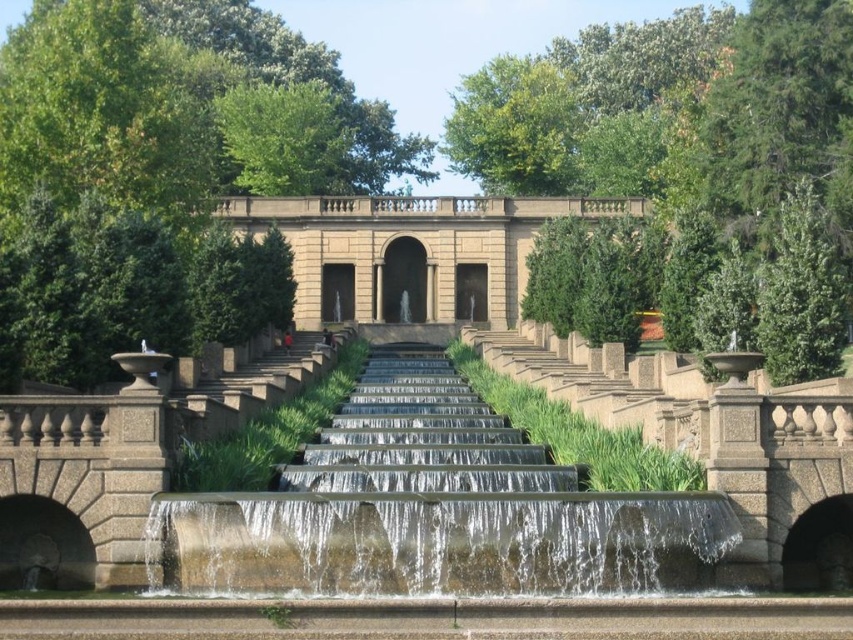
Question: Observing the image, what is the correct spatial positioning of beige stone palace at center in reference to smooth stone stairs at center?

Choices:
 (A) right
 (B) left

Answer: (A)

Question: Estimate the real-world distances between objects in this image. Which object is farther from the smooth stone stairs at center?

Choices:
 (A) beige stone palace at center
 (B) smooth concrete fountain at center

Answer: (A)

Question: Which object is closer to the camera taking this photo?

Choices:
 (A) smooth stone stairs at center
 (B) smooth concrete fountain at center

Answer: (B)

Question: Does beige stone palace at center have a greater width compared to smooth stone stairs at center?

Choices:
 (A) no
 (B) yes

Answer: (B)

Question: Is smooth concrete fountain at center positioned behind smooth stone stairs at center?

Choices:
 (A) no
 (B) yes

Answer: (A)

Question: Which object is farther from the camera taking this photo?

Choices:
 (A) smooth stone stairs at center
 (B) smooth concrete fountain at center
 (C) beige stone palace at center

Answer: (C)